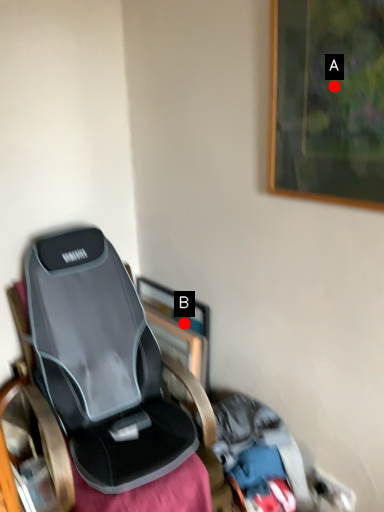
Question: Two points are circled on the image, labeled by A and B beside each circle. Among these points, which one is farthest from the camera?

Choices:
 (A) A is further
 (B) B is further

Answer: (B)